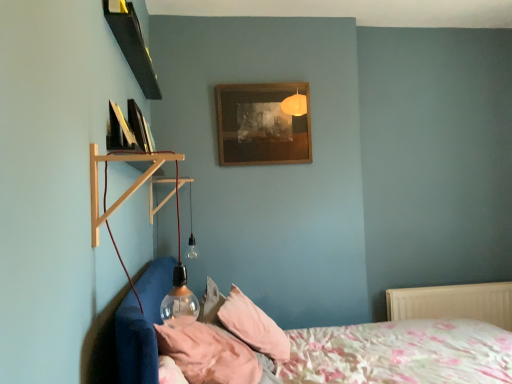
Question: Considering the relative sizes of wooden shelf at left and pink fabric pillow at lower center, the 1th pillow positioned from the back, in the image provided, is wooden shelf at left shorter than pink fabric pillow at lower center, the 1th pillow positioned from the back,?

Choices:
 (A) no
 (B) yes

Answer: (A)

Question: From the image's perspective, is wooden shelf at left below pink fabric pillow at lower center, the 1th pillow positioned from the back?

Choices:
 (A) no
 (B) yes

Answer: (A)

Question: From a real-world perspective, is wooden shelf at left below pink fabric pillow at lower center, the 1th pillow positioned from the back?

Choices:
 (A) no
 (B) yes

Answer: (A)

Question: Does wooden shelf at left turn towards pink fabric pillow at lower center, which is the second pillow in front-to-back order?

Choices:
 (A) no
 (B) yes

Answer: (A)

Question: Is wooden shelf at left thinner than pink fabric pillow at lower center, the 1th pillow positioned from the back?

Choices:
 (A) no
 (B) yes

Answer: (B)

Question: Is wooden shelf at left to the right of pink fabric pillow at lower center, the 1th pillow positioned from the back, from the viewer's perspective?

Choices:
 (A) no
 (B) yes

Answer: (A)

Question: Is black glossy picture frame at upper left, acting as the first picture frame starting from the left, facing towards wooden shelf at left?

Choices:
 (A) no
 (B) yes

Answer: (A)

Question: Considering the relative sizes of black glossy picture frame at upper left, acting as the first picture frame starting from the left, and wooden shelf at left in the image provided, is black glossy picture frame at upper left, acting as the first picture frame starting from the left, wider than wooden shelf at left?

Choices:
 (A) no
 (B) yes

Answer: (A)

Question: From the image's perspective, is black glossy picture frame at upper left, acting as the first picture frame starting from the left, located beneath wooden shelf at left?

Choices:
 (A) no
 (B) yes

Answer: (A)

Question: From the image's perspective, would you say black glossy picture frame at upper left, which is the 2th picture frame from right to left, is positioned over wooden shelf at left?

Choices:
 (A) yes
 (B) no

Answer: (A)

Question: Is the position of black glossy picture frame at upper left, acting as the first picture frame starting from the left, less distant than that of wooden shelf at left?

Choices:
 (A) no
 (B) yes

Answer: (A)

Question: Are black glossy picture frame at upper left, which is the 2th picture frame from right to left, and wooden shelf at left making contact?

Choices:
 (A) yes
 (B) no

Answer: (B)

Question: Can you confirm if floral cotton bed at lower left is smaller than pink fabric pillow at lower center, which is the second pillow in back-to-front order?

Choices:
 (A) no
 (B) yes

Answer: (A)